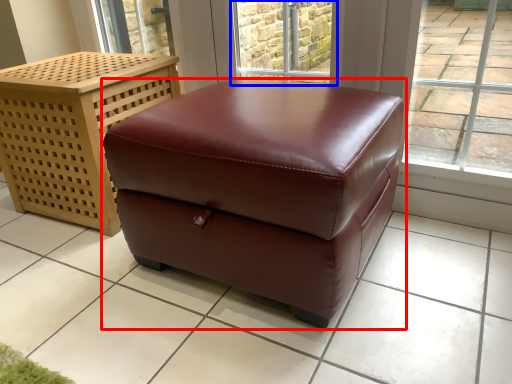
Question: Which point is further to the camera, table (highlighted by a red box) or window (highlighted by a blue box)?

Choices:
 (A) table
 (B) window

Answer: (B)